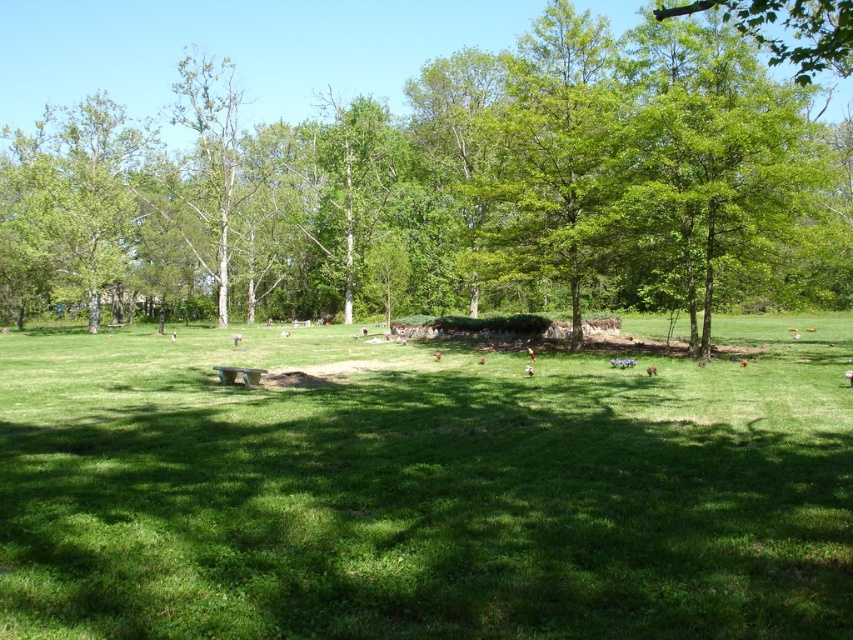
Is green grassy area at center bigger than green leafy tree at center?

Incorrect, green grassy area at center is not larger than green leafy tree at center.

Is green grassy area at center positioned before green leafy tree at center?

Yes, it is in front of green leafy tree at center.

Does point (532, 477) lie in front of point (189, 300)?

Yes, point (532, 477) is closer to viewer.

Where is `green grassy area at center`? green grassy area at center is located at coordinates point(422,490).

Does green grassy area at center have a smaller size compared to green leafy tree at upper right?

Correct, green grassy area at center occupies less space than green leafy tree at upper right.

Between point (636, 534) and point (813, 38), which one is positioned behind?

Point (813, 38)

Locate an element on the screen. The height and width of the screenshot is (640, 853). green grassy area at center is located at coordinates (422, 490).

Is green leafy tree at center to the right of green leafy tree at upper right from the viewer's perspective?

Incorrect, green leafy tree at center is not on the right side of green leafy tree at upper right.

Is point (740, 257) less distant than point (833, 29)?

Yes, it is in front of point (833, 29).

Locate an element on the screen. green leafy tree at center is located at coordinates (460, 184).